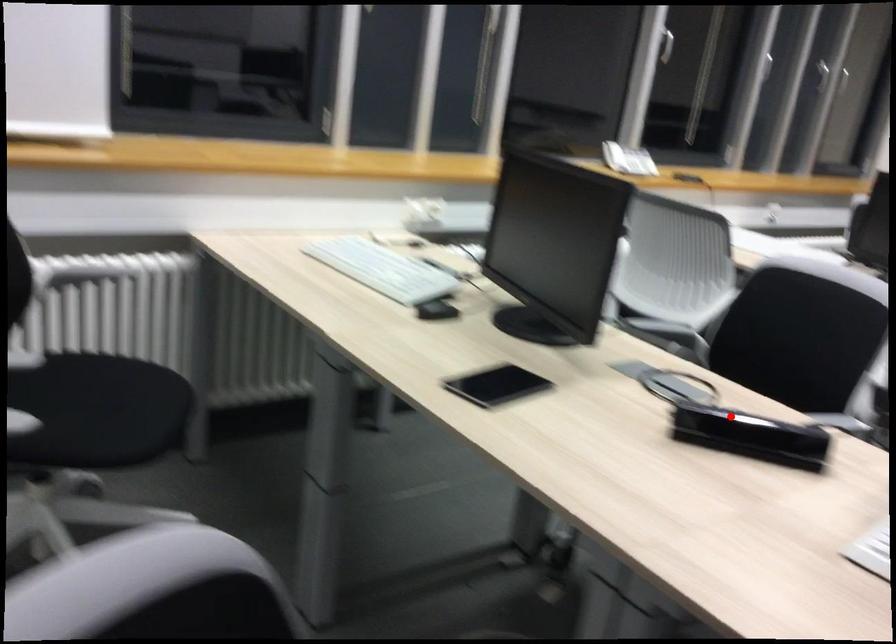
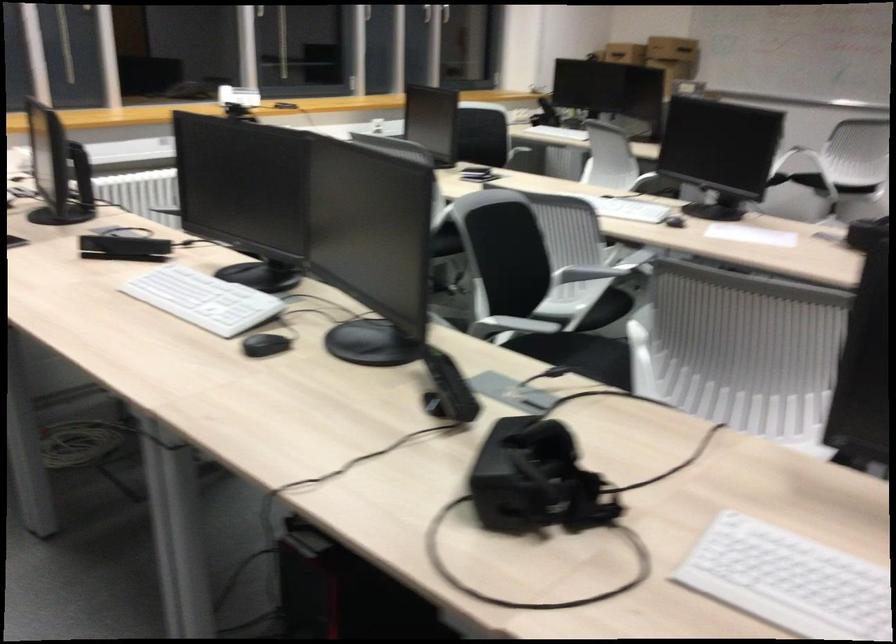
Locate, in the second image, the point that corresponds to the highlighted location in the first image.

(124, 247)